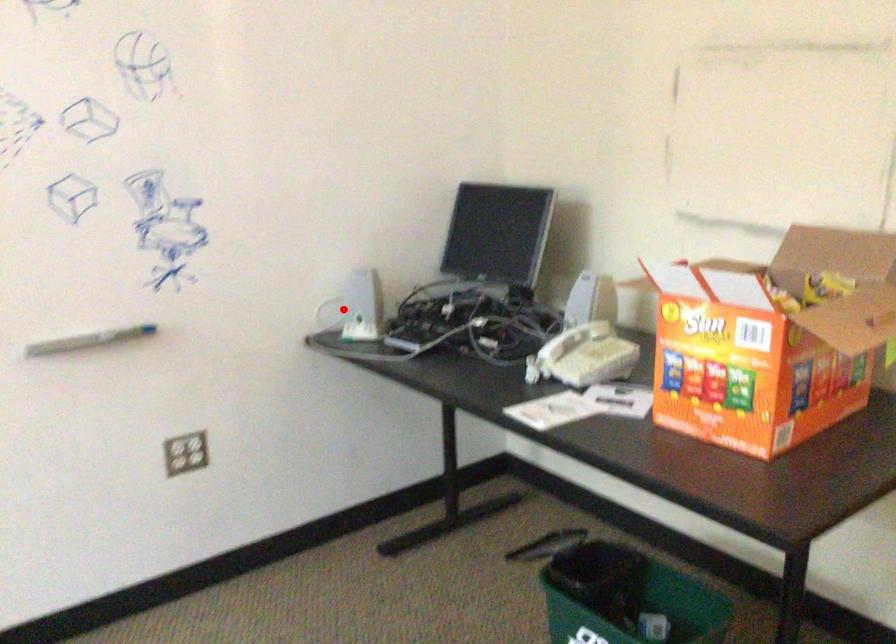
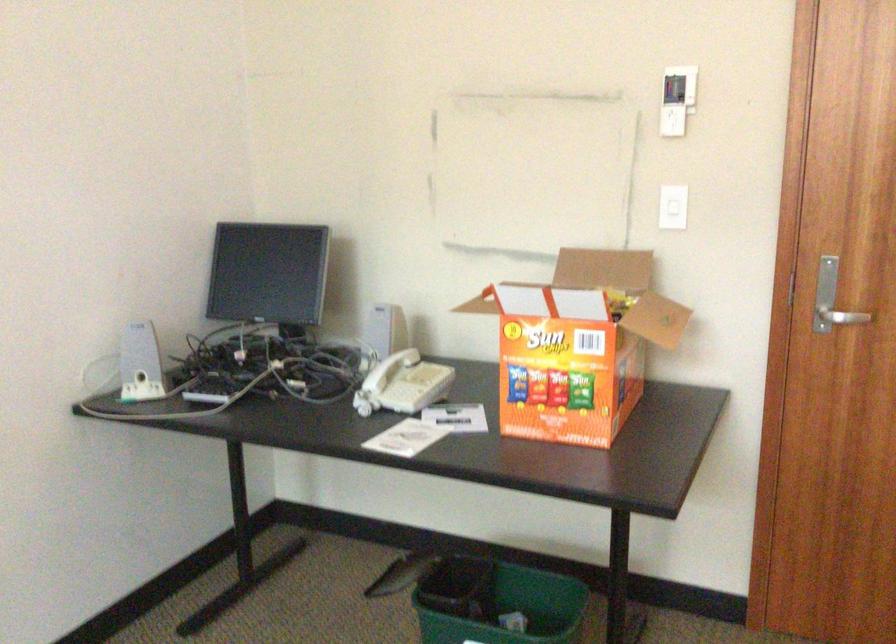
The point at the highlighted location is marked in the first image. Where is the corresponding point in the second image?

(140, 363)